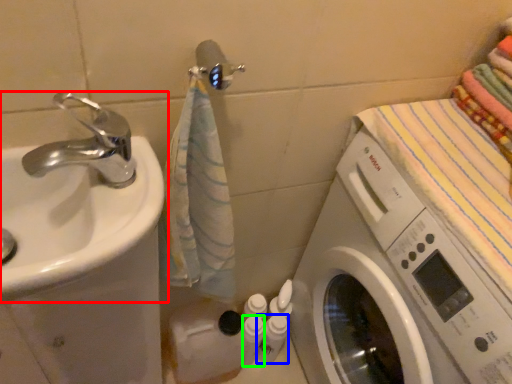
Question: Which object is positioned farthest from sink (highlighted by a red box)? Select from toiletry (highlighted by a blue box) and toiletry (highlighted by a green box).

Choices:
 (A) toiletry
 (B) toiletry

Answer: (A)